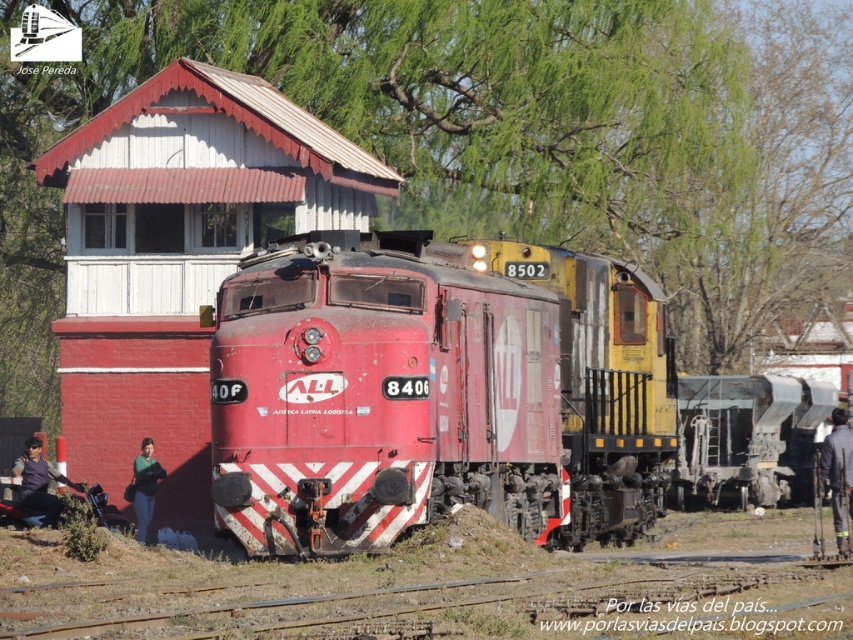
Question: Among these points, which one is nearest to the camera?

Choices:
 (A) (86, 372)
 (B) (149, 515)

Answer: (B)

Question: Does dark blue uniform at center appear on the right side of dark blue fabric jacket at lower left?

Choices:
 (A) yes
 (B) no

Answer: (A)

Question: Which point is closer to the camera taking this photo?

Choices:
 (A) tap(724, 408)
 (B) tap(824, 472)
 (C) tap(148, 458)

Answer: (B)

Question: Does brick railway station at center appear under dark blue fabric jacket at lower left?

Choices:
 (A) no
 (B) yes

Answer: (A)

Question: Does matte red locomotive at center appear over green fabric shirt at lower left?

Choices:
 (A) yes
 (B) no

Answer: (A)

Question: Which of these objects is positioned closest to the brick railway station at center?

Choices:
 (A) dark blue uniform at center
 (B) matte red locomotive at center
 (C) green fabric shirt at lower left
 (D) metallic gray tank car at center

Answer: (C)